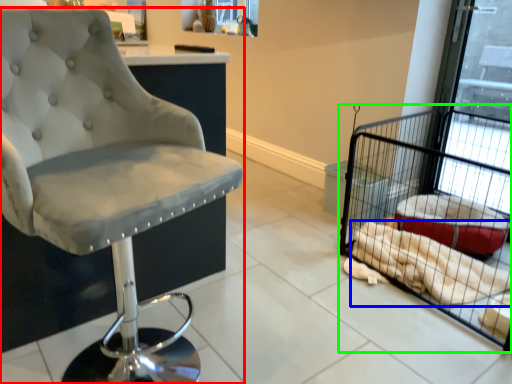
Question: Which object is the closest to the chair (highlighted by a red box)? Choose among these: material (highlighted by a blue box) or bird cage (highlighted by a green box).

Choices:
 (A) material
 (B) bird cage

Answer: (A)